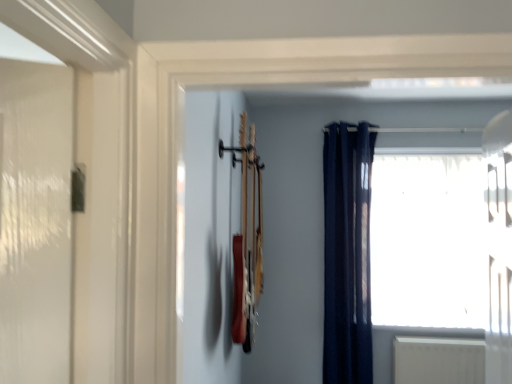
You are a GUI agent. You are given a task and a screenshot of the screen. Output one action in this format:
    pyautogui.click(x=<x>, y=<y>)
    Task: Click on the transparent glass window at upper right
    The image size is (512, 384).
    Given the screenshot: What is the action you would take?
    pyautogui.click(x=428, y=241)

Measure the distance between transparent glass window at upper right and camera.

transparent glass window at upper right and camera are 2.75 meters apart from each other.

Describe the element at coordinates (428, 241) in the screenshot. This screenshot has height=384, width=512. I see `transparent glass window at upper right` at that location.

Image resolution: width=512 pixels, height=384 pixels. What do you see at coordinates (347, 254) in the screenshot?
I see `navy blue fabric curtain at right` at bounding box center [347, 254].

Locate an element on the screen. navy blue fabric curtain at right is located at coordinates (347, 254).

Where is `transparent glass window at upper right`? transparent glass window at upper right is located at coordinates (428, 241).

Which object is positioned more to the left, navy blue fabric curtain at right or transparent glass window at upper right?

navy blue fabric curtain at right.

Is navy blue fabric curtain at right positioned behind transparent glass window at upper right?

No, the depth of navy blue fabric curtain at right is less than that of transparent glass window at upper right.

Is point (357, 290) closer or farther from the camera than point (463, 301)?

Point (357, 290) is positioned closer to the camera compared to point (463, 301).

From the image's perspective, who appears lower, navy blue fabric curtain at right or transparent glass window at upper right?

navy blue fabric curtain at right, from the image's perspective.

From a real-world perspective, which is physically below, navy blue fabric curtain at right or transparent glass window at upper right?

navy blue fabric curtain at right, from a real-world perspective.

Does navy blue fabric curtain at right have a greater width compared to transparent glass window at upper right?

Correct, the width of navy blue fabric curtain at right exceeds that of transparent glass window at upper right.

Considering the relative sizes of navy blue fabric curtain at right and transparent glass window at upper right in the image provided, is navy blue fabric curtain at right shorter than transparent glass window at upper right?

No, navy blue fabric curtain at right is not shorter than transparent glass window at upper right.

Considering the relative sizes of navy blue fabric curtain at right and transparent glass window at upper right in the image provided, is navy blue fabric curtain at right bigger than transparent glass window at upper right?

No.

Consider the image. Is transparent glass window at upper right completely or partially inside navy blue fabric curtain at right?

No, transparent glass window at upper right is not surrounded by navy blue fabric curtain at right.

Is navy blue fabric curtain at right not near transparent glass window at upper right?

Actually, navy blue fabric curtain at right and transparent glass window at upper right are a little close together.

Is transparent glass window at upper right at the back of navy blue fabric curtain at right?

No, navy blue fabric curtain at right is not facing away from transparent glass window at upper right.

How many degrees apart are the facing directions of navy blue fabric curtain at right and transparent glass window at upper right?

navy blue fabric curtain at right and transparent glass window at upper right are facing 0.875 degrees away from each other.

Based on the photo, how distant is navy blue fabric curtain at right from transparent glass window at upper right?

16.32 inches.

The height and width of the screenshot is (384, 512). Identify the location of curtain in front of the transparent glass window at upper right. (347, 254).

Considering the relative positions of transparent glass window at upper right and navy blue fabric curtain at right in the image provided, is transparent glass window at upper right to the left of navy blue fabric curtain at right from the viewer's perspective?

In fact, transparent glass window at upper right is to the right of navy blue fabric curtain at right.

Is the position of transparent glass window at upper right less distant than that of navy blue fabric curtain at right?

No, transparent glass window at upper right is further to the viewer.

Which is in front, point (470, 251) or point (336, 234)?

The point (336, 234) is in front.

From the image's perspective, between transparent glass window at upper right and navy blue fabric curtain at right, which one is located above?

transparent glass window at upper right appears higher in the image.

From a real-world perspective, who is located higher, transparent glass window at upper right or navy blue fabric curtain at right?

transparent glass window at upper right.

Between transparent glass window at upper right and navy blue fabric curtain at right, which one has larger width?

navy blue fabric curtain at right is wider.

Considering the sizes of transparent glass window at upper right and navy blue fabric curtain at right in the image, is transparent glass window at upper right taller or shorter than navy blue fabric curtain at right?

transparent glass window at upper right is shorter than navy blue fabric curtain at right.

Who is bigger, transparent glass window at upper right or navy blue fabric curtain at right?

With larger size is transparent glass window at upper right.

Is navy blue fabric curtain at right completely or partially inside transparent glass window at upper right?

No.

Are transparent glass window at upper right and navy blue fabric curtain at right making contact?

There is a gap between transparent glass window at upper right and navy blue fabric curtain at right.

Is transparent glass window at upper right oriented towards navy blue fabric curtain at right?

No, transparent glass window at upper right is not oriented towards navy blue fabric curtain at right.

Identify the location of window on the right of navy blue fabric curtain at right. (428, 241).

This screenshot has width=512, height=384. In order to click on window that appears behind the navy blue fabric curtain at right in this screenshot , I will do `click(428, 241)`.

Image resolution: width=512 pixels, height=384 pixels. Find the location of `window that is above the navy blue fabric curtain at right (from a real-world perspective)`. window that is above the navy blue fabric curtain at right (from a real-world perspective) is located at coordinates (428, 241).